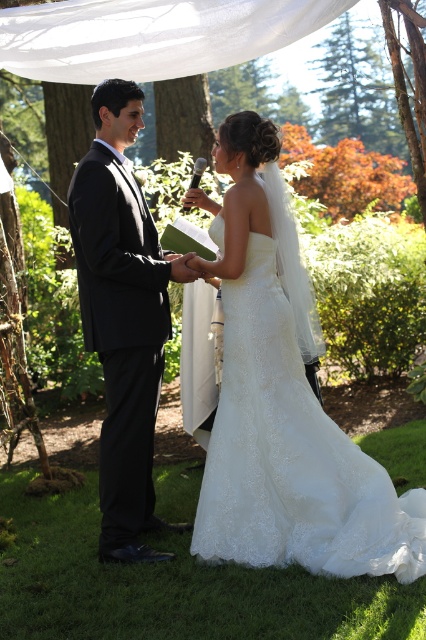
Question: Is white lace dress at center smaller than white lace wedding dress at center?

Choices:
 (A) no
 (B) yes

Answer: (A)

Question: Which point is farther to the camera?

Choices:
 (A) (132, 253)
 (B) (221, 141)
 (C) (255, 497)

Answer: (B)

Question: Can you confirm if white lace wedding dress at center is thinner than black satin suit at left?

Choices:
 (A) yes
 (B) no

Answer: (B)

Question: From the image, what is the correct spatial relationship of white lace wedding dress at center in relation to black satin suit at left?

Choices:
 (A) above
 (B) below

Answer: (B)

Question: Based on their relative distances, which object is nearer to the white lace dress at center?

Choices:
 (A) black satin suit at left
 (B) white lace wedding dress at center

Answer: (B)

Question: Which point is farther from the camera taking this photo?

Choices:
 (A) (359, 497)
 (B) (120, 218)

Answer: (B)